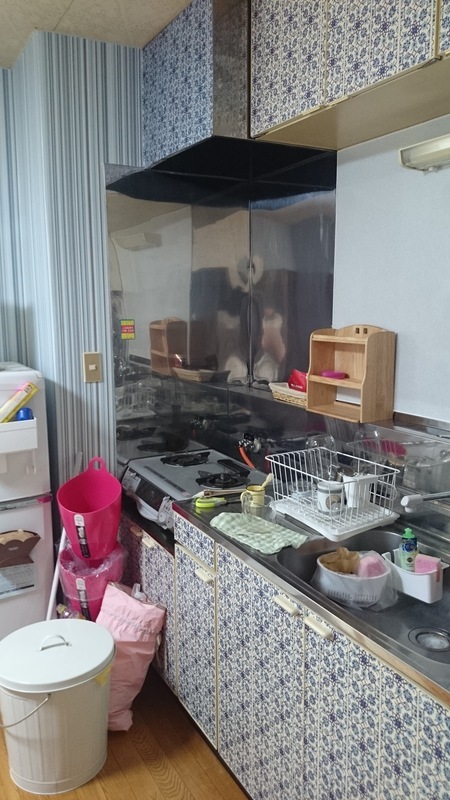
Locate an element on the screen. The height and width of the screenshot is (800, 450). white organizer is located at coordinates (407, 585), (343, 589).